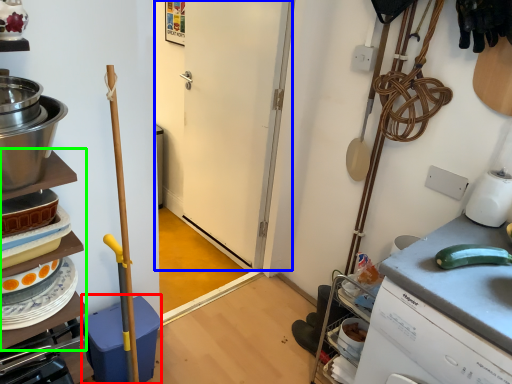
Question: Considering the real-world distances, which object is farthest from dish washer (highlighted by a red box)? door (highlighted by a blue box) or shelf (highlighted by a green box)?

Choices:
 (A) door
 (B) shelf

Answer: (A)